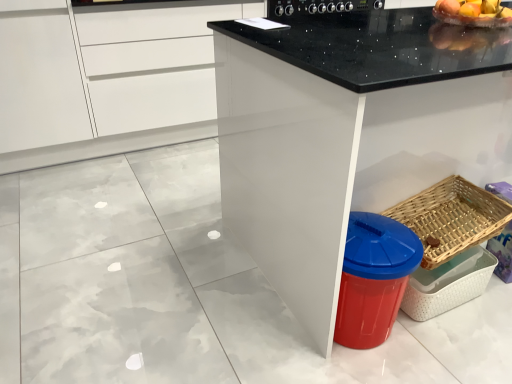
Question: From the image's perspective, is black granite countertop at center positioned above or below woven wood basket at lower right?

Choices:
 (A) above
 (B) below

Answer: (A)

Question: Is point (252, 62) positioned closer to the camera than point (458, 180)?

Choices:
 (A) farther
 (B) closer

Answer: (B)

Question: Estimate the real-world distances between objects in this image. Which object is farther from the shiny plastic bowl at upper right?

Choices:
 (A) black granite countertop at center
 (B) woven wood basket at lower right
 (C) black glossy stove at upper center
 (D) white glossy cabinet at upper left

Answer: (D)

Question: Based on their relative distances, which object is farther from the black granite countertop at center?

Choices:
 (A) white glossy cabinet at upper left
 (B) black glossy stove at upper center
 (C) woven wood basket at lower right
 (D) shiny plastic bowl at upper right

Answer: (A)